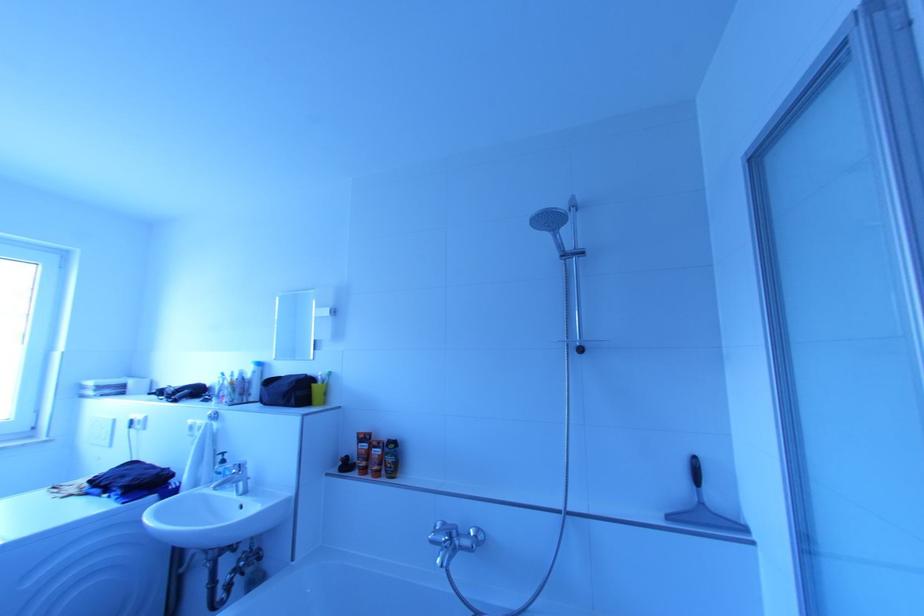
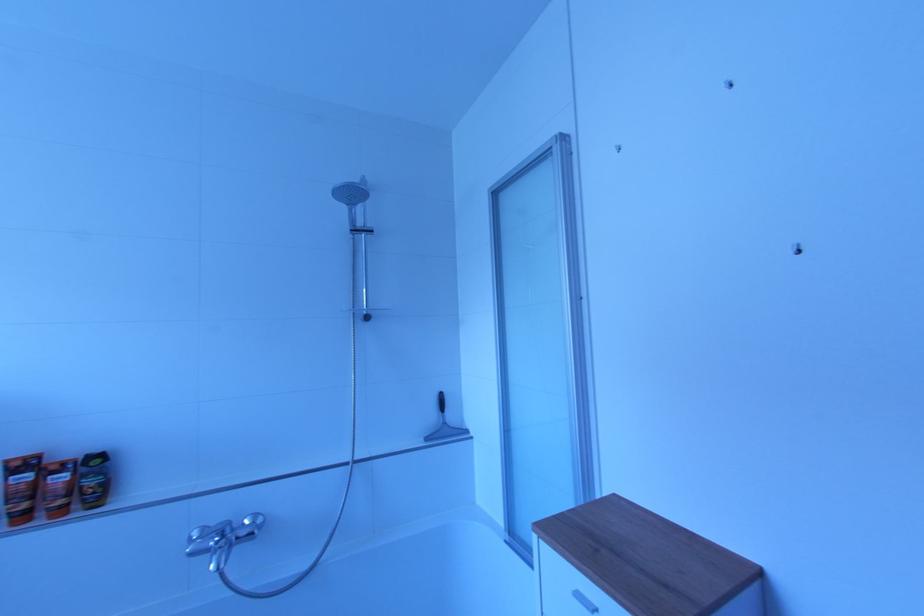
Question: How did the camera likely rotate?

Choices:
 (A) Left
 (B) Right
 (C) Up
 (D) Down

Answer: (B)